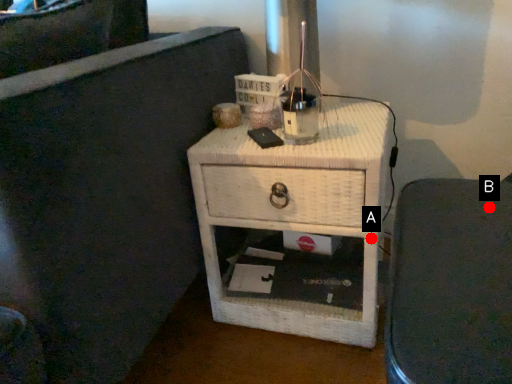
Question: Two points are circled on the image, labeled by A and B beside each circle. Which point is closer to the camera?

Choices:
 (A) A is closer
 (B) B is closer

Answer: (B)